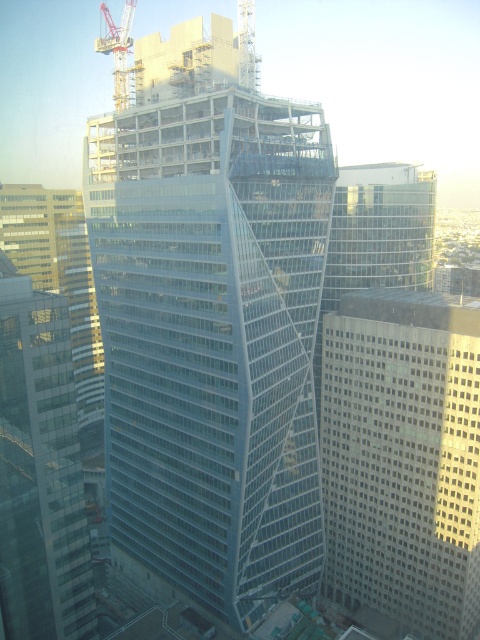
You are standing in front of the skyscraper and want to take a photo. You notice two points marked on the building at coordinates point (420, 544) and point (80, 550). Which point is closer to your camera when taking the photo?

Point (80, 550) is closer to the camera because it is located lower on the building compared to point (420, 544), which is higher up and thus further away.

You are an architect reviewing a city plan. You notice the glassy steel skyscraper at center and the gray concrete building at center. Which one is positioned higher in the image?

The glassy steel skyscraper at center is positioned higher in the image than the gray concrete building at center.